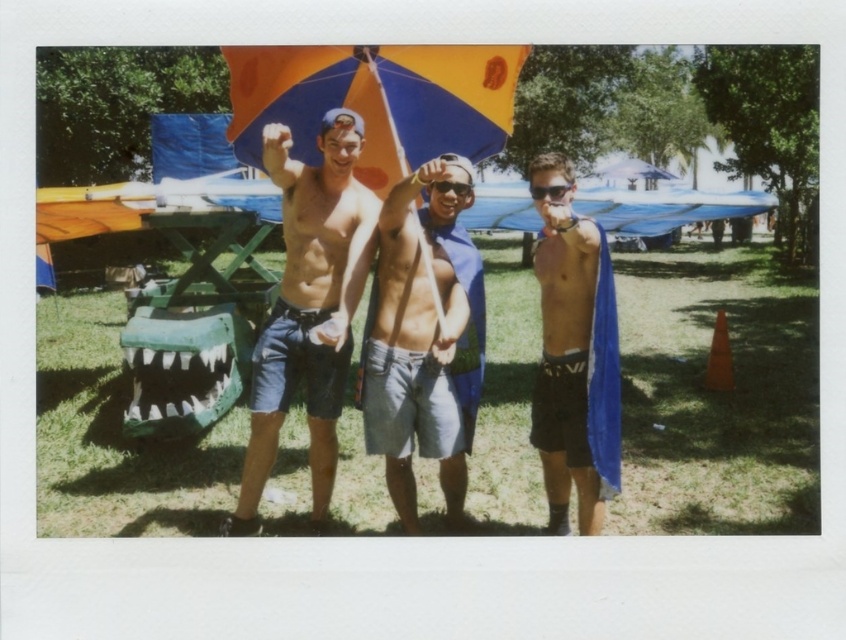
Question: Is gray cotton shorts at center positioned in front of matte blue shorts at center?

Choices:
 (A) no
 (B) yes

Answer: (B)

Question: Among these points, which one is nearest to the camera?

Choices:
 (A) (248, 58)
 (B) (298, 273)
 (C) (409, 509)
 (D) (551, 195)

Answer: (D)

Question: Which object is farther from the camera taking this photo?

Choices:
 (A) black matte shorts at center
 (B) matte blue shorts at center
 (C) black plastic sunglasses at center

Answer: (C)

Question: Does black matte shorts at center have a lesser width compared to black plastic sunglasses at center?

Choices:
 (A) no
 (B) yes

Answer: (A)

Question: Can you confirm if orange and blue umbrella at center is wider than black plastic goggles at center?

Choices:
 (A) no
 (B) yes

Answer: (B)

Question: Which of the following is the closest to the observer?

Choices:
 (A) (468, 237)
 (B) (464, 195)
 (C) (415, 147)
 (D) (573, 186)

Answer: (D)